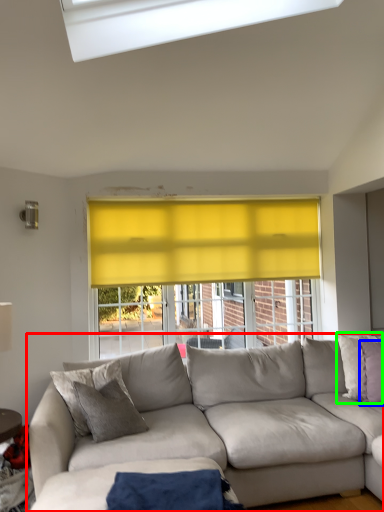
Question: Estimate the real-world distances between objects in this image. Which object is closer to studio couch (highlighted by a red box), pillow (highlighted by a blue box) or pillow (highlighted by a green box)?

Choices:
 (A) pillow
 (B) pillow

Answer: (B)